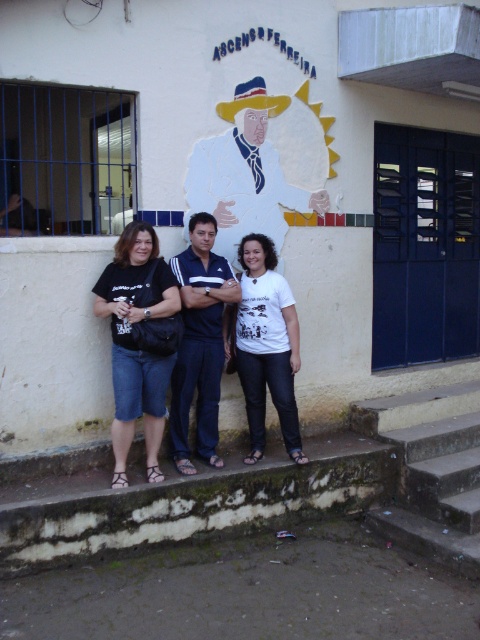
Does concrete stairs at lower center have a lesser width compared to matte white cowboy hat at center?

Incorrect, concrete stairs at lower center's width is not less than matte white cowboy hat at center's.

Is point (27, 560) behind point (288, 104)?

No.

Locate an element on the screen. concrete stairs at lower center is located at coordinates (280, 490).

Can you confirm if denim shorts at left is positioned to the right of white matte shirt at center?

Incorrect, denim shorts at left is not on the right side of white matte shirt at center.

Between denim shorts at left and white matte shirt at center, which one has more height?

With more height is denim shorts at left.

Does point (151, 304) come behind point (295, 440)?

No, (151, 304) is closer to viewer.

The height and width of the screenshot is (640, 480). I want to click on denim shorts at left, so click(134, 342).

Does concrete stairs at lower right appear on the left side of blue fabric shirt at center?

No, concrete stairs at lower right is not to the left of blue fabric shirt at center.

This screenshot has width=480, height=640. What are the coordinates of `concrete stairs at lower right` in the screenshot? It's located at (431, 470).